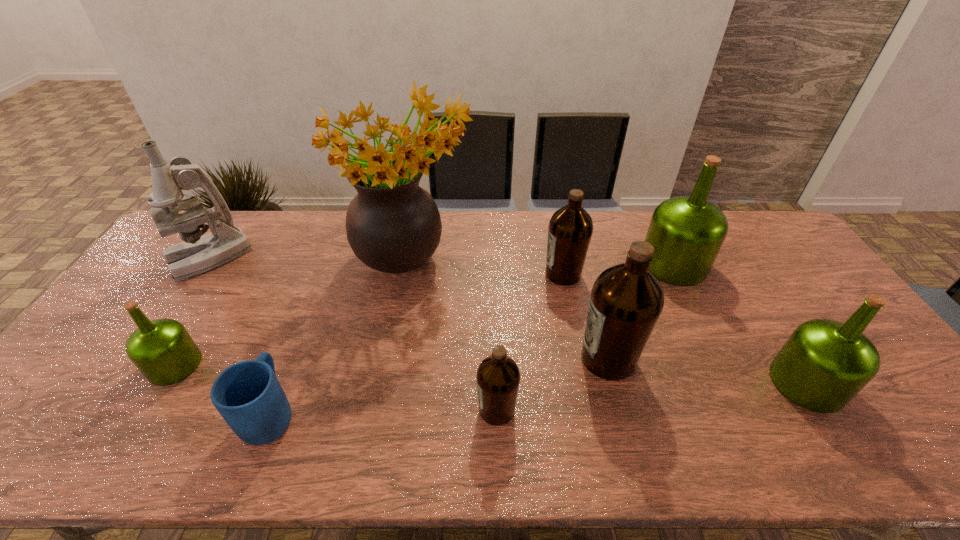
Identify the location of the fourth object from left to right. This screenshot has height=540, width=960. (393, 225).

Where is `the tallest object`? the tallest object is located at coordinates (393, 225).

Find the location of a particular element. The image size is (960, 540). microscope is located at coordinates (197, 254).

Identify the location of the biggest green olive oil. (687, 232).

The width and height of the screenshot is (960, 540). Identify the location of the biggest brown olive oil. (627, 299).

At what (x,y) coordinates should I click in order to perform the action: click on the second smallest green olive oil. Please return your answer as a coordinate pair (x, y). This screenshot has height=540, width=960. Looking at the image, I should click on 824,364.

This screenshot has height=540, width=960. Find the location of `the second smallest brown olive oil`. the second smallest brown olive oil is located at coordinates (570, 229).

At what (x,y) coordinates should I click in order to perform the action: click on the leftmost olive oil. Please return your answer as a coordinate pair (x, y). The height and width of the screenshot is (540, 960). Looking at the image, I should click on (162, 349).

Where is `the smallest green olive oil`? This screenshot has width=960, height=540. the smallest green olive oil is located at coordinates (162, 349).

The height and width of the screenshot is (540, 960). Find the location of `the smallest brown olive oil`. the smallest brown olive oil is located at coordinates (498, 377).